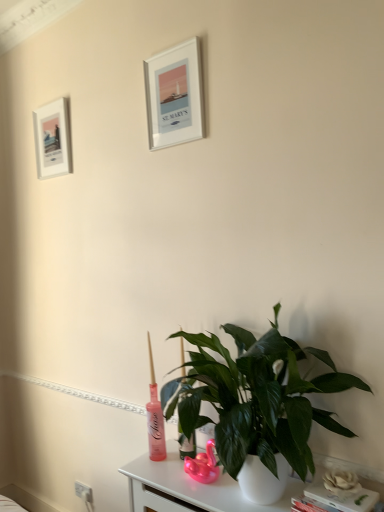
What do you see at coordinates (255, 398) in the screenshot? I see `green glossy plant at lower center` at bounding box center [255, 398].

The image size is (384, 512). What do you see at coordinates (52, 139) in the screenshot?
I see `white matte picture frame at upper left, acting as the first picture frame starting from the back` at bounding box center [52, 139].

What are the coordinates of `white plastic electric outlet at lower left` in the screenshot? It's located at (83, 492).

Could you tell me if silver metallic picture frame at upper center, the 2th picture frame positioned from the back, is facing white glossy table at lower center?

No, silver metallic picture frame at upper center, the 2th picture frame positioned from the back, is not turned towards white glossy table at lower center.

From a real-world perspective, which object stands above the other?

silver metallic picture frame at upper center, the 2th picture frame positioned from the back, from a real-world perspective.

Which object is positioned more to the right, silver metallic picture frame at upper center, which ranks as the 2th picture frame in left-to-right order, or white glossy table at lower center?

From the viewer's perspective, white glossy table at lower center appears more on the right side.

Is silver metallic picture frame at upper center, acting as the 1th picture frame starting from the front, not close to white glossy table at lower center?

That's right, there is a large distance between silver metallic picture frame at upper center, acting as the 1th picture frame starting from the front, and white glossy table at lower center.

Is silver metallic picture frame at upper center, which is counted as the first picture frame, starting from the right, touching white plastic electric outlet at lower left?

No, silver metallic picture frame at upper center, which is counted as the first picture frame, starting from the right, is not beside white plastic electric outlet at lower left.

Considering the sizes of objects silver metallic picture frame at upper center, the 2th picture frame positioned from the back, and white plastic electric outlet at lower left in the image provided, who is bigger, silver metallic picture frame at upper center, the 2th picture frame positioned from the back, or white plastic electric outlet at lower left?

silver metallic picture frame at upper center, the 2th picture frame positioned from the back.

From the image's perspective, which one is positioned lower, silver metallic picture frame at upper center, acting as the 1th picture frame starting from the front, or white plastic electric outlet at lower left?

From the image's view, white plastic electric outlet at lower left is below.

Which point is more forward, (267, 337) or (43, 139)?

Point (267, 337)

Could you measure the distance between green glossy plant at lower center and white matte picture frame at upper left, arranged as the 2th picture frame when viewed from the right?

They are 5.33 feet apart.

Relative to white matte picture frame at upper left, acting as the first picture frame starting from the back, is green glossy plant at lower center in front or behind?

green glossy plant at lower center is in front of white matte picture frame at upper left, acting as the first picture frame starting from the back.

From the image's perspective, starting from the green glossy plant at lower center, which picture frame is the 1st one above? Please provide its 2D coordinates.

[(52, 139)]

From the image's perspective, is white plastic electric outlet at lower left below white matte picture frame at upper left, acting as the first picture frame starting from the back?

Yes.

Is white plastic electric outlet at lower left taller or shorter than white matte picture frame at upper left, arranged as the 2th picture frame when viewed from the right?

white plastic electric outlet at lower left is shorter than white matte picture frame at upper left, arranged as the 2th picture frame when viewed from the right.

Find the location of `electric outlet below the white matte picture frame at upper left, which appears as the first picture frame when viewed from the left (from a real-world perspective)`. electric outlet below the white matte picture frame at upper left, which appears as the first picture frame when viewed from the left (from a real-world perspective) is located at coordinates (83, 492).

From a real-world perspective, which is physically below, white plastic electric outlet at lower left or white matte picture frame at upper left, which appears as the first picture frame when viewed from the left?

white plastic electric outlet at lower left, from a real-world perspective.

Which object is thinner, white plastic electric outlet at lower left or green glossy plant at lower center?

With smaller width is white plastic electric outlet at lower left.

In the scene shown: From a real-world perspective, relative to green glossy plant at lower center, is white plastic electric outlet at lower left vertically above or below?

white plastic electric outlet at lower left is situated lower than green glossy plant at lower center in the real world.

Which of these two, white plastic electric outlet at lower left or green glossy plant at lower center, stands taller?

Standing taller between the two is green glossy plant at lower center.

Is white plastic electric outlet at lower left not within green glossy plant at lower center?

white plastic electric outlet at lower left lies outside green glossy plant at lower center's area.

From the image's perspective, is white glossy table at lower center positioned above or below white plastic electric outlet at lower left?

white glossy table at lower center is above white plastic electric outlet at lower left.

Identify the location of table to the right of white plastic electric outlet at lower left. This screenshot has width=384, height=512. [189, 488].

Is white glossy table at lower center positioned in front of white plastic electric outlet at lower left?

Yes, white glossy table at lower center is closer to the viewer.

Considering the positions of points (49, 109) and (347, 509), is point (49, 109) closer to camera compared to point (347, 509)?

No, (49, 109) is behind (347, 509).

From the picture: Considering the positions of objects white matte picture frame at upper left, arranged as the 2th picture frame when viewed from the right, and white matte book at lower right in the image provided, who is behind, white matte picture frame at upper left, arranged as the 2th picture frame when viewed from the right, or white matte book at lower right?

white matte picture frame at upper left, arranged as the 2th picture frame when viewed from the right, is further from the camera.

From the picture: Can you confirm if white matte picture frame at upper left, acting as the first picture frame starting from the back, is positioned to the left of white matte book at lower right?

Indeed, white matte picture frame at upper left, acting as the first picture frame starting from the back, is positioned on the left side of white matte book at lower right.

Are white matte picture frame at upper left, which appears as the second picture frame when viewed from the front, and white matte book at lower right making contact?

No, white matte picture frame at upper left, which appears as the second picture frame when viewed from the front, is not making contact with white matte book at lower right.

Starting from the white glossy table at lower center, which picture frame is the 1st one behind? Please provide its 2D coordinates.

[(174, 96)]

In order to click on electric outlet that appears below the silver metallic picture frame at upper center, which ranks as the 2th picture frame in left-to-right order (from the image's perspective) in this screenshot , I will do point(83,492).

Based on their spatial positions, is white plastic electric outlet at lower left or white matte flower at lower right closer to white matte book at lower right?

white matte flower at lower right.

When comparing their distances from white plastic electric outlet at lower left, does white matte picture frame at upper left, which appears as the second picture frame when viewed from the front, or white glossy table at lower center seem further?

white matte picture frame at upper left, which appears as the second picture frame when viewed from the front, is further to white plastic electric outlet at lower left.

From the image, which object appears to be farther from silver metallic picture frame at upper center, which ranks as the 2th picture frame in left-to-right order, white matte flower at lower right or white matte picture frame at upper left, which appears as the first picture frame when viewed from the left?

white matte flower at lower right.

When comparing their distances from white matte book at lower right, does white matte picture frame at upper left, arranged as the 2th picture frame when viewed from the right, or silver metallic picture frame at upper center, acting as the 1th picture frame starting from the front, seem further?

Among the two, white matte picture frame at upper left, arranged as the 2th picture frame when viewed from the right, is located further to white matte book at lower right.

Estimate the real-world distances between objects in this image. Which object is closer to white matte flower at lower right, white matte picture frame at upper left, arranged as the 2th picture frame when viewed from the right, or green glossy plant at lower center?

green glossy plant at lower center lies closer to white matte flower at lower right than the other object.

Which object lies nearer to the anchor point white matte book at lower right, white matte flower at lower right or white plastic electric outlet at lower left?

white matte flower at lower right lies closer to white matte book at lower right than the other object.

Based on their spatial positions, is green glossy plant at lower center or silver metallic picture frame at upper center, which is counted as the first picture frame, starting from the right, closer to white matte book at lower right?

The object closer to white matte book at lower right is green glossy plant at lower center.

From the image, which object appears to be nearer to white matte book at lower right, white matte picture frame at upper left, acting as the first picture frame starting from the back, or green glossy plant at lower center?

green glossy plant at lower center lies closer to white matte book at lower right than the other object.

The width and height of the screenshot is (384, 512). Find the location of `houseplant between silver metallic picture frame at upper center, the 2th picture frame positioned from the back, and white glossy table at lower center in the up-down direction`. houseplant between silver metallic picture frame at upper center, the 2th picture frame positioned from the back, and white glossy table at lower center in the up-down direction is located at coordinates (255, 398).

Image resolution: width=384 pixels, height=512 pixels. Identify the location of picture frame that lies between silver metallic picture frame at upper center, acting as the 1th picture frame starting from the front, and white plastic electric outlet at lower left from top to bottom. (52, 139).

Locate an element on the screen. The width and height of the screenshot is (384, 512). book between silver metallic picture frame at upper center, the 2th picture frame positioned from the back, and white glossy table at lower center, in the vertical direction is located at coordinates (336, 500).

Where is `flower positioned between white matte book at lower right and white plastic electric outlet at lower left from near to far`? flower positioned between white matte book at lower right and white plastic electric outlet at lower left from near to far is located at coordinates (341, 482).